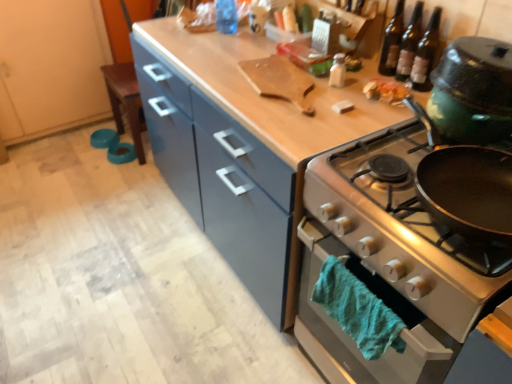
Question: Considering the positions of silver metallic oven at right and shiny plastic container at upper right in the image, is silver metallic oven at right wider or thinner than shiny plastic container at upper right?

Choices:
 (A) wide
 (B) thin

Answer: (A)

Question: Based on their positions, is silver metallic oven at right located to the left or right of shiny plastic container at upper right?

Choices:
 (A) left
 (B) right

Answer: (B)

Question: Which of these objects is positioned closest to the clear glass bottles at upper right?

Choices:
 (A) shiny plastic container at upper right
 (B) teal fuzzy towel at lower right
 (C) wooden cutting board at upper center
 (D) transparent plastic bottle at upper center, which appears as the 2th bottle when ordered from the bottom
 (E) silver metallic oven at right

Answer: (A)

Question: Estimate the real-world distances between objects in this image. Which object is farther from the dark brown glass bottles at upper right, which is counted as the 1th beer bottle, starting from the left?

Choices:
 (A) silver metallic oven at right
 (B) transparent plastic bottle at upper center, the first bottle viewed from the top
 (C) shiny plastic container at upper right
 (D) translucent glass bottles at upper right, which is counted as the 1th beer bottle, starting from the right
 (E) shiny silver gas stove at right

Answer: (B)